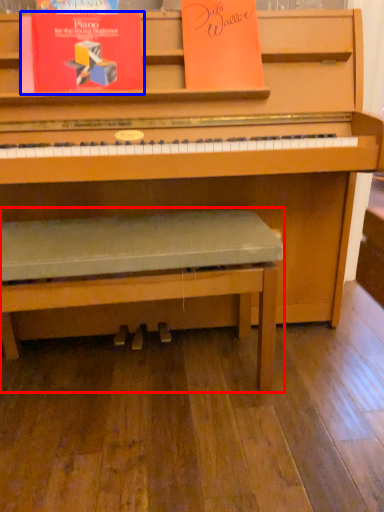
Question: Among these objects, which one is farthest to the camera, church bench (highlighted by a red box) or paperback book (highlighted by a blue box)?

Choices:
 (A) church bench
 (B) paperback book

Answer: (B)